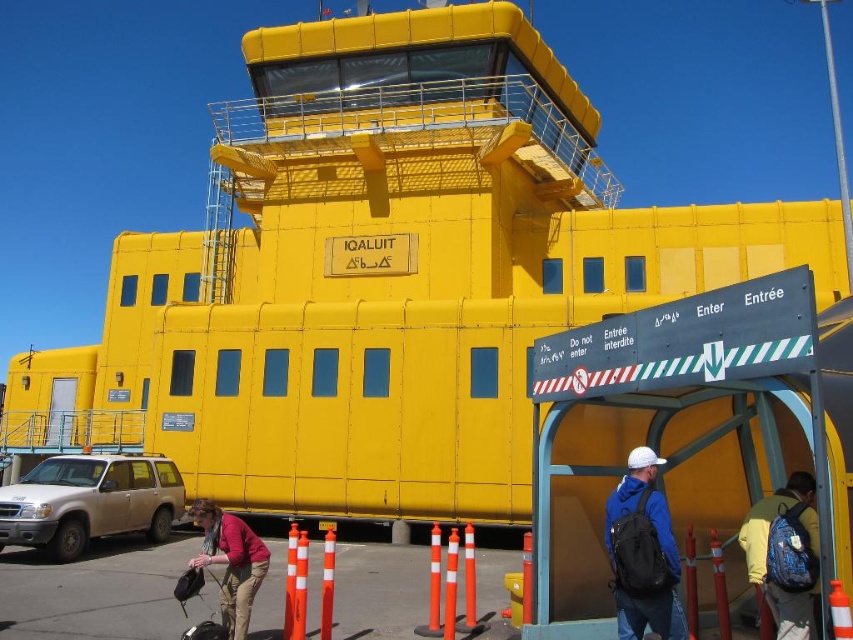
Question: Which point is farther to the camera?

Choices:
 (A) (241, 592)
 (B) (833, 632)

Answer: (A)

Question: Which point is closer to the camera taking this photo?

Choices:
 (A) (831, 627)
 (B) (643, 515)
 (C) (805, 499)
 (D) (242, 625)

Answer: (A)

Question: Does silver metallic suv at lower left appear on the left side of orange plastic cone at center?

Choices:
 (A) yes
 (B) no

Answer: (A)

Question: Which of the following is the farthest from the observer?

Choices:
 (A) blue fabric backpack at center
 (B) blue backpack at lower right
 (C) matte pink sweater at lower left
 (D) silver metallic suv at lower left

Answer: (D)

Question: Does blue backpack at lower right come behind orange plastic cone at center?

Choices:
 (A) no
 (B) yes

Answer: (B)

Question: Can you confirm if blue backpack at lower right is wider than orange plastic cone at center?

Choices:
 (A) no
 (B) yes

Answer: (B)